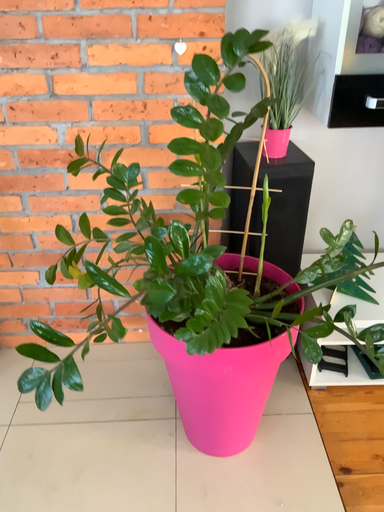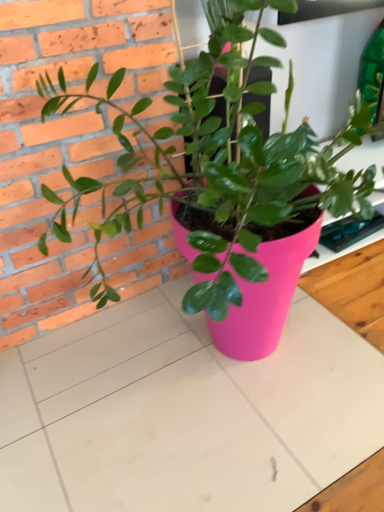
Question: Which way did the camera rotate in the video?

Choices:
 (A) rotated right
 (B) rotated left

Answer: (A)